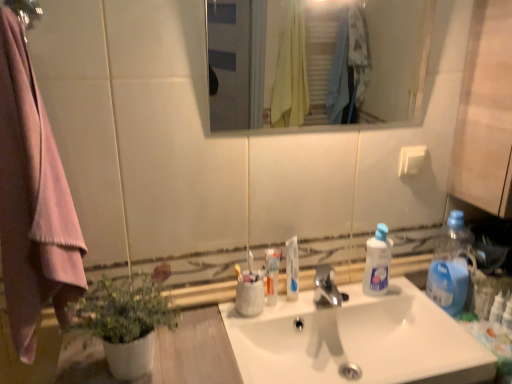
This screenshot has height=384, width=512. What do you see at coordinates (272, 275) in the screenshot?
I see `white glossy toothpaste at center, which ranks as the second toothpaste in right-to-left order` at bounding box center [272, 275].

The width and height of the screenshot is (512, 384). Identify the location of clear glass mirror at upper center. (316, 61).

The image size is (512, 384). What do you see at coordinates (357, 340) in the screenshot? I see `white glossy sink at center` at bounding box center [357, 340].

This screenshot has height=384, width=512. I want to click on white glossy toothpaste at center, the 2th toothpaste from the left, so click(x=292, y=268).

Image resolution: width=512 pixels, height=384 pixels. Describe the element at coordinates (292, 268) in the screenshot. I see `white glossy toothpaste at center, the 2th toothpaste from the left` at that location.

Describe the element at coordinates (326, 287) in the screenshot. Image resolution: width=512 pixels, height=384 pixels. I see `satin nickel faucet at center` at that location.

Locate an element on the screen. The height and width of the screenshot is (384, 512). yellow plastic toothbrush at center, marked as the 1th toothbrush in a left-to-right arrangement is located at coordinates pyautogui.click(x=238, y=272).

Where is `white glossy toothpaste at center, which ranks as the second toothpaste in right-to-left order`? The width and height of the screenshot is (512, 384). white glossy toothpaste at center, which ranks as the second toothpaste in right-to-left order is located at coordinates (272, 275).

Can you tell me how much matte black shower at upper left and satin nickel faucet at center differ in facing direction?

matte black shower at upper left and satin nickel faucet at center are facing 0.00208 degrees away from each other.

Would you say matte black shower at upper left is inside or outside satin nickel faucet at center?

matte black shower at upper left exists outside the volume of satin nickel faucet at center.

This screenshot has width=512, height=384. Identify the location of faucet located on the right of matte black shower at upper left. (326, 287).

From a real-world perspective, which object stands above the other?

matte black shower at upper left is physically above.

Is transparent plastic bottle at sink, marked as the 1th bottle in a left-to-right arrangement, spatially inside matte gray cup at center, or outside of it?

→ transparent plastic bottle at sink, marked as the 1th bottle in a left-to-right arrangement, is spatially situated outside matte gray cup at center.

Identify the location of coffee cup lying in front of the transparent plastic bottle at sink, which is the second bottle in right-to-left order. The image size is (512, 384). 249,298.

Considering the positions of objects transparent plastic bottle at sink, which is the second bottle in right-to-left order, and matte gray cup at center in the image provided, who is more to the right, transparent plastic bottle at sink, which is the second bottle in right-to-left order, or matte gray cup at center?

From the viewer's perspective, transparent plastic bottle at sink, which is the second bottle in right-to-left order, appears more on the right side.

From a real-world perspective, is transparent plastic bottle at sink, which is the second bottle in right-to-left order, on top of matte gray cup at center?

Yes, from a real-world perspective, transparent plastic bottle at sink, which is the second bottle in right-to-left order, is above matte gray cup at center.

From a real-world perspective, is matte gray cup at center under white glossy sink at center?

Incorrect, from a real-world perspective, matte gray cup at center is higher than white glossy sink at center.

In order to click on coffee cup located above the white glossy sink at center (from the image's perspective) in this screenshot , I will do `click(249, 298)`.

From the image's perspective, is matte gray cup at center located beneath white glossy sink at center?

No, from the image's perspective, matte gray cup at center is not below white glossy sink at center.

Considering their positions, is matte gray cup at center located in front of or behind white glossy sink at center?

matte gray cup at center is positioned farther from the viewer than white glossy sink at center.

I want to click on the 2nd bottle behind the yellow plastic toothbrush at center, positioned as the 2th toothbrush in right-to-left order, counting from the anchor's position, so click(x=377, y=263).

Based on the photo, is transparent plastic bottle at sink, marked as the 1th bottle in a left-to-right arrangement, positioned with its back to yellow plastic toothbrush at center, positioned as the 2th toothbrush in right-to-left order?

transparent plastic bottle at sink, marked as the 1th bottle in a left-to-right arrangement, is not turned away from yellow plastic toothbrush at center, positioned as the 2th toothbrush in right-to-left order.

Can you confirm if transparent plastic bottle at sink, marked as the 1th bottle in a left-to-right arrangement, is positioned to the right of yellow plastic toothbrush at center, marked as the 1th toothbrush in a left-to-right arrangement?

Correct, you'll find transparent plastic bottle at sink, marked as the 1th bottle in a left-to-right arrangement, to the right of yellow plastic toothbrush at center, marked as the 1th toothbrush in a left-to-right arrangement.

From a real-world perspective, which is physically above, transparent plastic bottle at sink, which is the second bottle in right-to-left order, or yellow plastic toothbrush at center, marked as the 1th toothbrush in a left-to-right arrangement?

yellow plastic toothbrush at center, marked as the 1th toothbrush in a left-to-right arrangement, from a real-world perspective.

Can you confirm if blue plastic bottle at right, the 1th bottle viewed from the right, is thinner than white plastic toothbrush at center, marked as the 2th toothbrush in a left-to-right arrangement?

No.

Consider the image. Is blue plastic bottle at right, the 1th bottle viewed from the right, positioned behind white plastic toothbrush at center, which ranks as the first toothbrush in right-to-left order?

Yes, it is behind white plastic toothbrush at center, which ranks as the first toothbrush in right-to-left order.

From a real-world perspective, is blue plastic bottle at right, the 1th bottle viewed from the right, above or below white plastic toothbrush at center, marked as the 2th toothbrush in a left-to-right arrangement?

blue plastic bottle at right, the 1th bottle viewed from the right, is situated lower than white plastic toothbrush at center, marked as the 2th toothbrush in a left-to-right arrangement, in the real world.

Considering the relative positions of blue plastic bottle at right, the 1th bottle viewed from the right, and white plastic toothbrush at center, which ranks as the first toothbrush in right-to-left order, in the image provided, is blue plastic bottle at right, the 1th bottle viewed from the right, to the left or to the right of white plastic toothbrush at center, which ranks as the first toothbrush in right-to-left order,?

blue plastic bottle at right, the 1th bottle viewed from the right, is to the right of white plastic toothbrush at center, which ranks as the first toothbrush in right-to-left order.

Does point (262, 295) lie behind point (466, 258)?

That is False.

From the image's perspective, is matte gray cup at center above blue plastic bottle at right, acting as the 2th bottle starting from the left?

No.

Are matte gray cup at center and blue plastic bottle at right, acting as the 2th bottle starting from the left, beside each other?

No, matte gray cup at center is not beside blue plastic bottle at right, acting as the 2th bottle starting from the left.

Is matte gray cup at center positioned before blue plastic bottle at right, acting as the 2th bottle starting from the left?

Yes, it is.

From the picture: Is clear glass mirror at upper center in front of or behind white glossy toothpaste at center, which ranks as the second toothpaste in right-to-left order, in the image?

clear glass mirror at upper center is positioned closer to the viewer than white glossy toothpaste at center, which ranks as the second toothpaste in right-to-left order.

What's the angular difference between clear glass mirror at upper center and white glossy toothpaste at center, the 1th toothpaste from the left,'s facing directions?

They differ by 0.00558 degrees in their facing directions.

Considering the points (244, 13) and (270, 266), which point is in front, point (244, 13) or point (270, 266)?

Point (270, 266)

From the image's perspective, would you say clear glass mirror at upper center is shown under white glossy toothpaste at center, which ranks as the second toothpaste in right-to-left order?

No, from the image's perspective, clear glass mirror at upper center is not beneath white glossy toothpaste at center, which ranks as the second toothpaste in right-to-left order.

Find the location of a particular element. faucet directly beneath the matte black shower at upper left (from a real-world perspective) is located at coordinates (326, 287).

Where is `coffee cup that is on the left side of transparent plastic bottle at sink, marked as the 1th bottle in a left-to-right arrangement`? coffee cup that is on the left side of transparent plastic bottle at sink, marked as the 1th bottle in a left-to-right arrangement is located at coordinates (249, 298).

Estimate the real-world distances between objects in this image. Which object is closer to white plastic toothbrush at center, marked as the 2th toothbrush in a left-to-right arrangement, yellow plastic toothbrush at center, marked as the 1th toothbrush in a left-to-right arrangement, or satin nickel faucet at center?

yellow plastic toothbrush at center, marked as the 1th toothbrush in a left-to-right arrangement, lies closer to white plastic toothbrush at center, marked as the 2th toothbrush in a left-to-right arrangement, than the other object.

Looking at the image, which one is located closer to blue plastic bottle at right, acting as the 2th bottle starting from the left, white plastic toothbrush at center, which ranks as the first toothbrush in right-to-left order, or satin nickel faucet at center?

The object closer to blue plastic bottle at right, acting as the 2th bottle starting from the left, is satin nickel faucet at center.

Looking at the image, which one is located closer to white glossy toothpaste at center, the 1th toothpaste from the left, yellow plastic toothbrush at center, positioned as the 2th toothbrush in right-to-left order, or green matte plant at lower left?

Among the two, yellow plastic toothbrush at center, positioned as the 2th toothbrush in right-to-left order, is located nearer to white glossy toothpaste at center, the 1th toothpaste from the left.

Considering their positions, is matte gray cup at center positioned closer to green matte plant at lower left than satin nickel faucet at center?

matte gray cup at center.

When comparing their distances from pink fabric towel at left, does white plastic toothbrush at center, marked as the 2th toothbrush in a left-to-right arrangement, or transparent plastic bottle at sink, which is the second bottle in right-to-left order, seem further?

Based on the image, transparent plastic bottle at sink, which is the second bottle in right-to-left order, appears to be further to pink fabric towel at left.

When comparing their distances from matte black shower at upper left, does white plastic toothbrush at center, marked as the 2th toothbrush in a left-to-right arrangement, or green matte plant at lower left seem further?

white plastic toothbrush at center, marked as the 2th toothbrush in a left-to-right arrangement, is positioned further to the anchor matte black shower at upper left.

Based on the photo, considering their positions, is green matte plant at lower left positioned closer to clear glass mirror at upper center than yellow plastic toothbrush at center, positioned as the 2th toothbrush in right-to-left order?

yellow plastic toothbrush at center, positioned as the 2th toothbrush in right-to-left order, is positioned closer to the anchor clear glass mirror at upper center.

Looking at the image, which one is located closer to transparent plastic bottle at sink, marked as the 1th bottle in a left-to-right arrangement, white glossy toothpaste at center, placed as the first toothpaste when sorted from right to left, or white glossy toothpaste at center, which ranks as the second toothpaste in right-to-left order?

Based on the image, white glossy toothpaste at center, placed as the first toothpaste when sorted from right to left, appears to be nearer to transparent plastic bottle at sink, marked as the 1th bottle in a left-to-right arrangement.

Locate an element on the screen. toothbrush positioned between green matte plant at lower left and matte gray cup at center from near to far is located at coordinates (250, 261).

Find the location of a particular element. faucet between matte black shower at upper left and transparent plastic bottle at sink, which is the second bottle in right-to-left order is located at coordinates (326, 287).

I want to click on faucet between matte black shower at upper left and matte gray cup at center from top to bottom, so click(326, 287).

This screenshot has width=512, height=384. Identify the location of faucet between white glossy toothpaste at center, the 2th toothpaste from the left, and blue plastic bottle at right, the 1th bottle viewed from the right, from left to right. (326, 287).